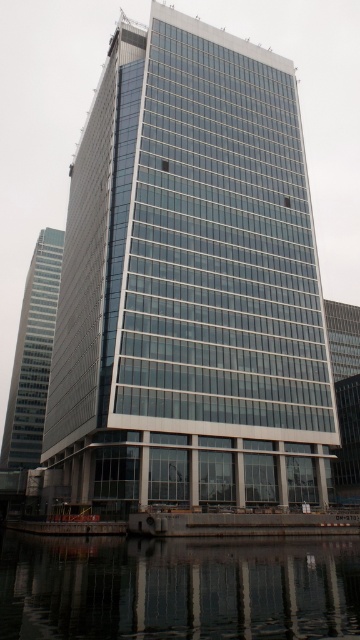
Question: Does transparent glass water at lower center appear on the right side of glassy reflective skyscraper at left?

Choices:
 (A) yes
 (B) no

Answer: (A)

Question: Can you confirm if glassy steel tower at center is positioned below glassy reflective skyscraper at left?

Choices:
 (A) no
 (B) yes

Answer: (A)

Question: Which of the following is the farthest from the observer?

Choices:
 (A) coord(304,467)
 (B) coord(46,557)

Answer: (A)

Question: Among these objects, which one is farthest from the camera?

Choices:
 (A) transparent glass water at lower center
 (B) glassy steel tower at center

Answer: (B)

Question: From the image, what is the correct spatial relationship of glassy steel tower at center in relation to glassy reflective skyscraper at left?

Choices:
 (A) above
 (B) below

Answer: (A)

Question: Considering the real-world distances, which object is closest to the glassy steel tower at center?

Choices:
 (A) glassy reflective skyscraper at left
 (B) transparent glass water at lower center

Answer: (B)